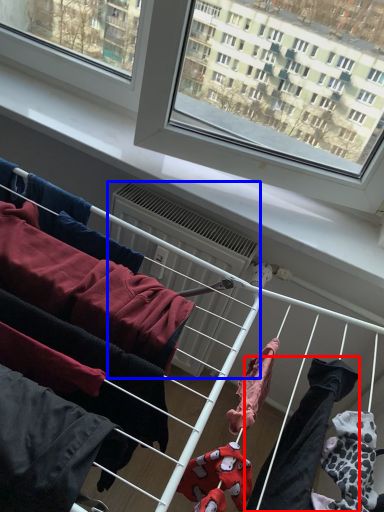
Question: Which of the following is the farthest to the observer, clothing (highlighted by a red box) or air conditioner (highlighted by a blue box)?

Choices:
 (A) clothing
 (B) air conditioner

Answer: (B)